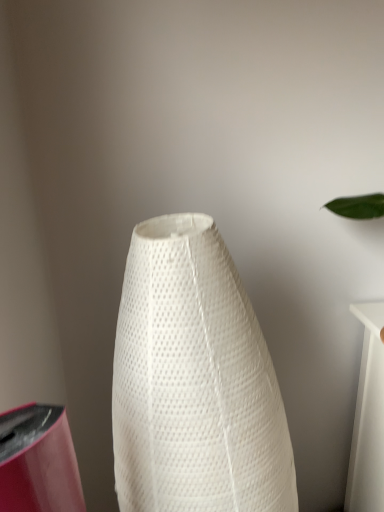
Describe the element at coordinates (194, 382) in the screenshot. I see `white textured cone at center` at that location.

At what (x,y) coordinates should I click in order to perform the action: click on white textured cone at center. Please return your answer as a coordinate pair (x, y). The width and height of the screenshot is (384, 512). Looking at the image, I should click on (194, 382).

Identify the location of white textured cone at center. (194, 382).